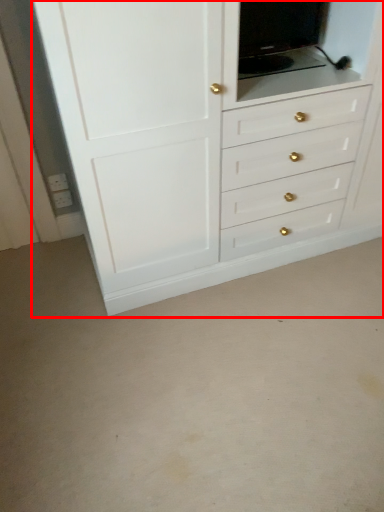
Question: Where is chest of drawers (annotated by the red box) located in relation to medicine cabinet in the image?

Choices:
 (A) right
 (B) left

Answer: (A)